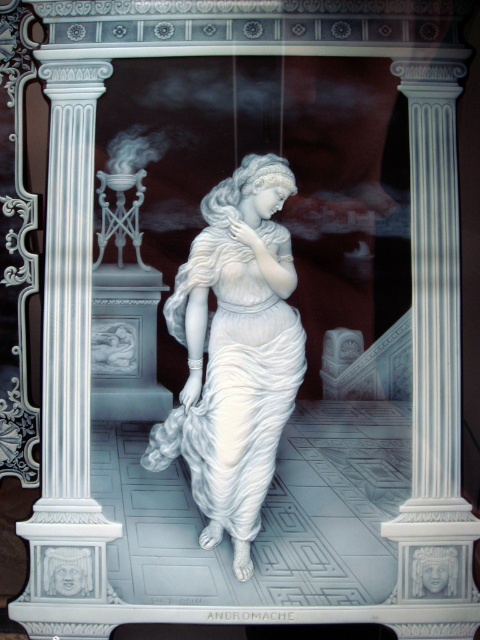
Question: Which object is closer to the camera taking this photo?

Choices:
 (A) white glossy dress at center
 (B) white marble column at left

Answer: (A)

Question: Which of the following is the closest to the observer?

Choices:
 (A) (158, 436)
 (B) (82, 522)

Answer: (A)

Question: Does white marble column at left appear under white glossy dress at center?

Choices:
 (A) yes
 (B) no

Answer: (B)

Question: Is white marble column at left closer to the viewer compared to white glossy dress at center?

Choices:
 (A) yes
 (B) no

Answer: (B)

Question: Which point appears closest to the camera in this image?

Choices:
 (A) (58, 406)
 (B) (228, 248)

Answer: (B)

Question: Is the position of white marble column at left more distant than that of white glossy dress at center?

Choices:
 (A) no
 (B) yes

Answer: (B)